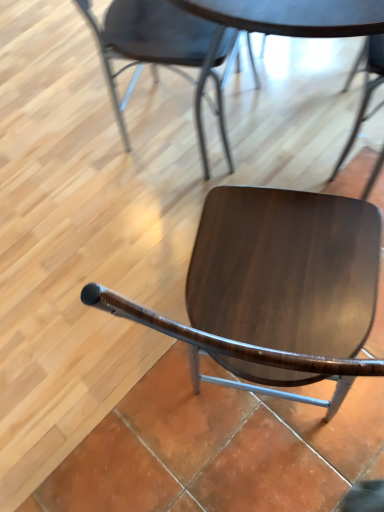
This screenshot has height=512, width=384. What are the coordinates of `free space to the right of matte black chair at upper center` in the screenshot? It's located at (291, 126).